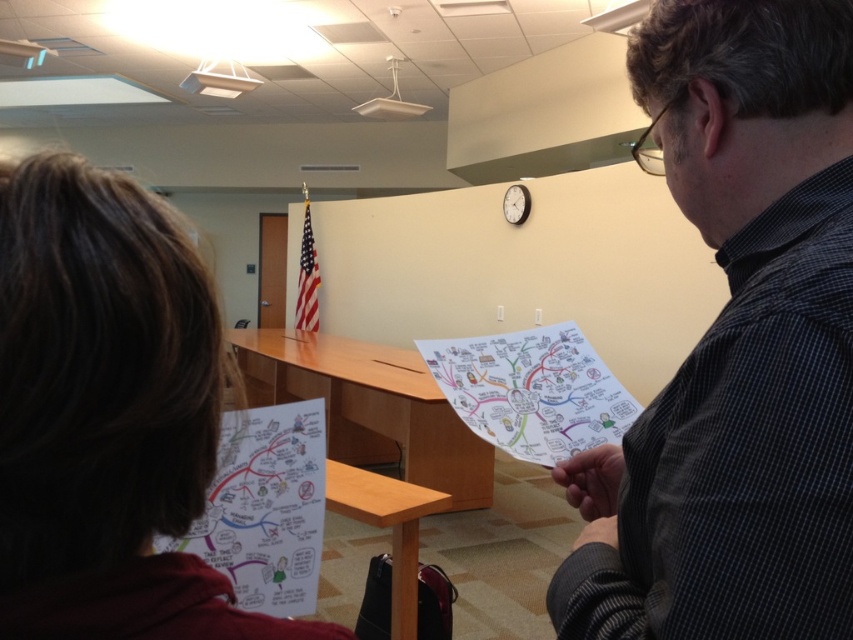
Question: From the image, what is the correct spatial relationship of dark gray checkered shirt at right in relation to brown hair at left?

Choices:
 (A) below
 (B) above

Answer: (B)

Question: Which is farther from the white paper map at lower left?

Choices:
 (A) brown hair at left
 (B) white paper map at center
 (C) dark gray checkered shirt at right

Answer: (C)

Question: Can you confirm if dark gray checkered shirt at right is positioned to the left of white paper map at center?

Choices:
 (A) no
 (B) yes

Answer: (A)

Question: Which point is closer to the camera taking this photo?

Choices:
 (A) (223, 531)
 (B) (577, 490)

Answer: (B)

Question: Is dark gray checkered shirt at right bigger than brown hair at left?

Choices:
 (A) no
 (B) yes

Answer: (B)

Question: Which object is farther from the camera taking this photo?

Choices:
 (A) white paper map at lower left
 (B) dark gray checkered shirt at right
 (C) brown hair at left
 (D) white paper map at center

Answer: (D)